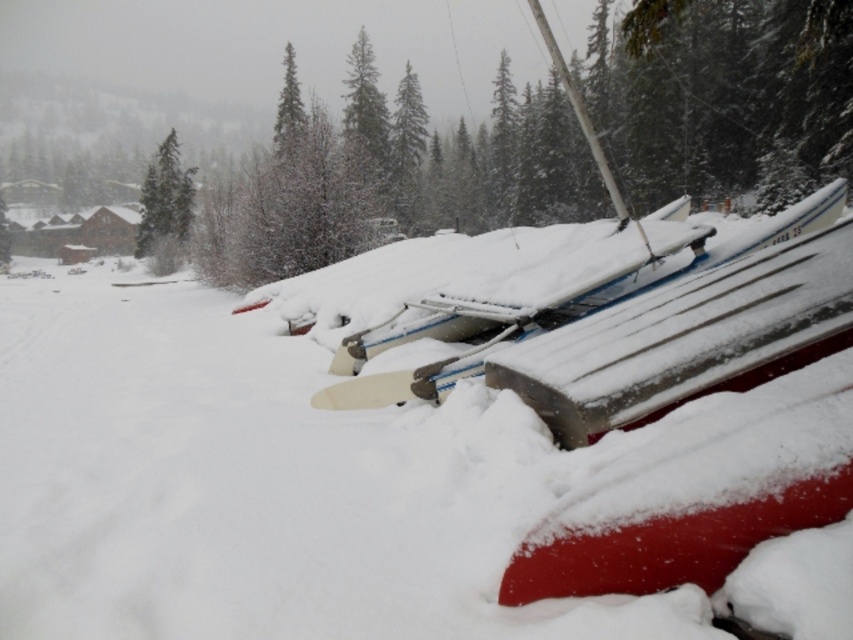
Question: Does white fluffy snow at center appear on the left side of green matte tree at upper left?

Choices:
 (A) no
 (B) yes

Answer: (A)

Question: Is white fluffy snow at center to the right of green matte tree at upper left from the viewer's perspective?

Choices:
 (A) no
 (B) yes

Answer: (B)

Question: Is the position of white fluffy snow at center more distant than that of green matte tree at upper left?

Choices:
 (A) yes
 (B) no

Answer: (B)

Question: Which object appears closest to the camera in this image?

Choices:
 (A) green matte tree at upper left
 (B) white fluffy snow at center

Answer: (B)

Question: Which point appears closest to the camera in this image?

Choices:
 (A) (672, 602)
 (B) (165, 240)

Answer: (A)

Question: Which point is farther to the camera?

Choices:
 (A) coord(376,410)
 (B) coord(152,188)

Answer: (B)